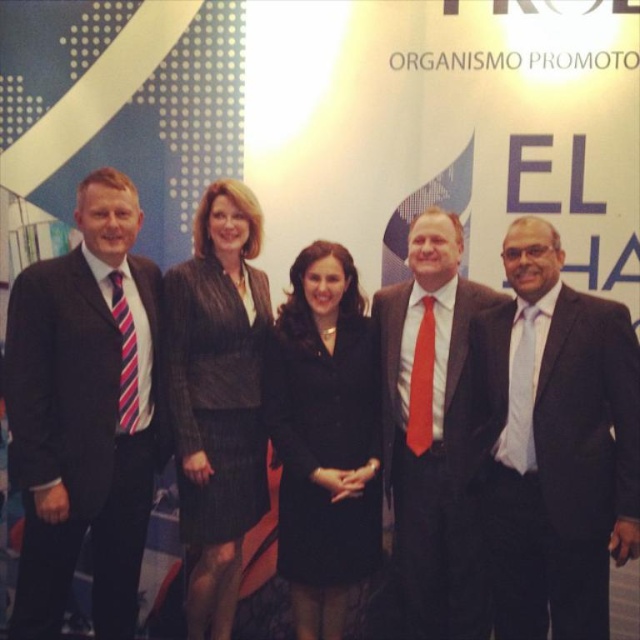
Can you confirm if black textured blazer at center is shorter than black wool coat at center?

No.

Is black textured blazer at center wider than black wool coat at center?

In fact, black textured blazer at center might be narrower than black wool coat at center.

Between point (256, 340) and point (337, 328), which one is positioned behind?

Point (337, 328)

This screenshot has width=640, height=640. I want to click on black textured blazer at center, so click(x=218, y=397).

Image resolution: width=640 pixels, height=640 pixels. Find the location of `black suit at right`. black suit at right is located at coordinates (557, 445).

Where is `black suit at right`? This screenshot has height=640, width=640. black suit at right is located at coordinates (557, 445).

Locate an element on the screen. This screenshot has height=640, width=640. black suit at right is located at coordinates (557, 445).

Is striped tie suit at left positioned in front of black wool coat at center?

Yes.

Locate an element on the screen. The height and width of the screenshot is (640, 640). striped tie suit at left is located at coordinates (84, 412).

Between point (28, 349) and point (340, 328), which one is positioned in front?

Point (28, 349)

What are the coordinates of `striped tie suit at left` in the screenshot? It's located at (84, 412).